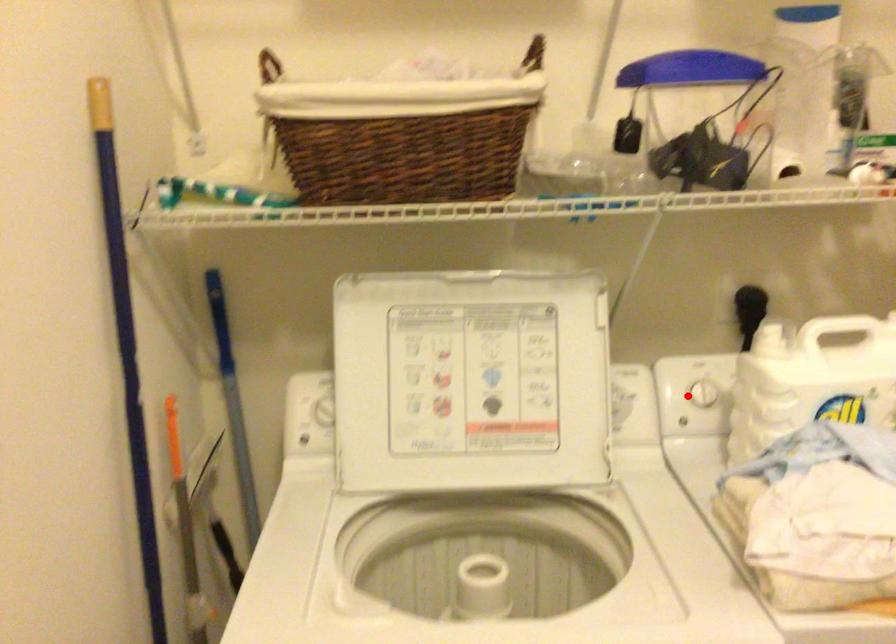
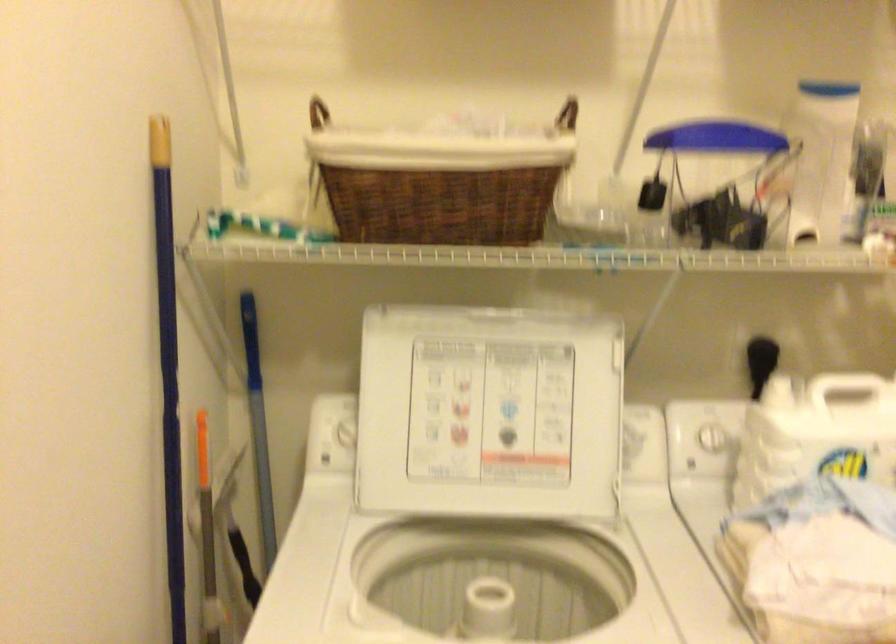
Locate, in the second image, the point that corresponds to the highlighted location in the first image.

(698, 440)